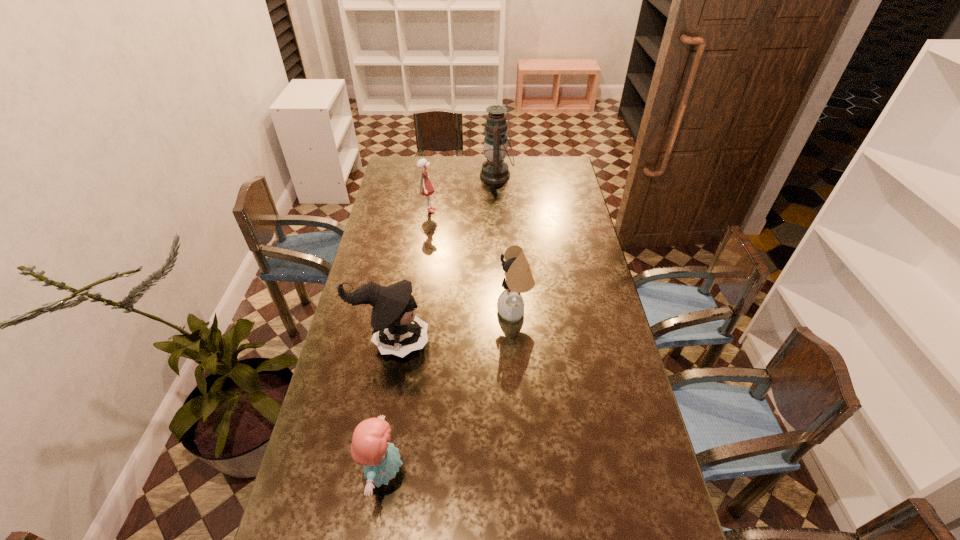
The image size is (960, 540). What are the coordinates of `the tallest object` in the screenshot? It's located at (494, 170).

In order to click on oil lamp in this screenshot , I will do `click(494, 170)`.

At what (x,y) coordinates should I click in order to perform the action: click on the rightmost doll. Please return your answer as a coordinate pair (x, y). This screenshot has height=540, width=960. Looking at the image, I should click on (519, 279).

Where is `the farthest doll`? The image size is (960, 540). the farthest doll is located at coordinates (425, 188).

I want to click on the nearest doll, so click(x=370, y=447).

Locate an element on the screen. vacant space situated on the left of the oil lamp is located at coordinates (408, 176).

At what (x,y) coordinates should I click in order to perform the action: click on vacant space located at the front face of the rightmost doll. Please return your answer as a coordinate pair (x, y). Looking at the image, I should click on pos(441,312).

Find the location of a particular element. This screenshot has width=960, height=540. free space located at the front face of the rightmost doll is located at coordinates (441, 312).

Find the location of a particular element. free space located 0.300m at the front face of the rightmost doll is located at coordinates (412, 312).

Where is `free region located 0.050m on the front-facing side of the farthest doll`? free region located 0.050m on the front-facing side of the farthest doll is located at coordinates (448, 211).